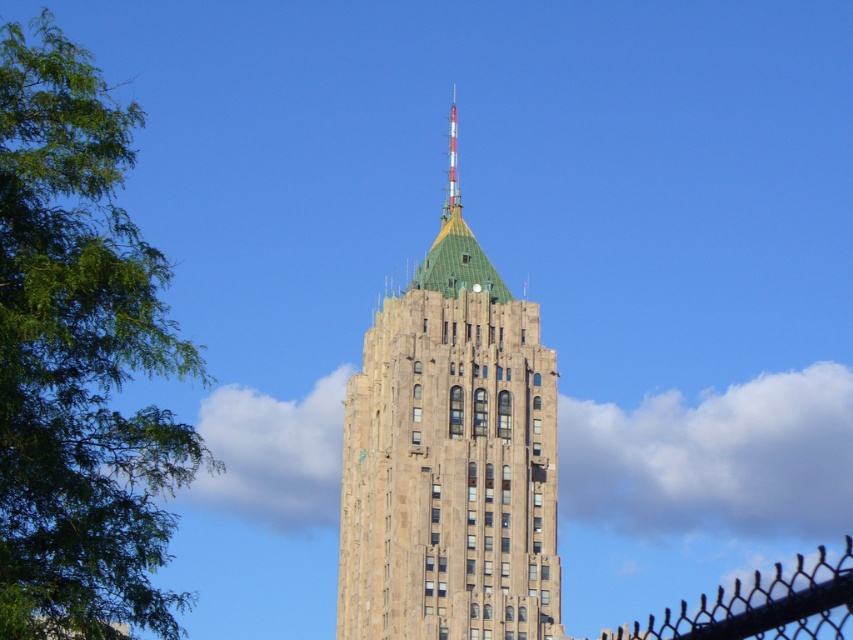
Who is higher up, black chain-link fence at lower right or white/red striped antenna at top?

white/red striped antenna at top is higher up.

Between black chain-link fence at lower right and white/red striped antenna at top, which one appears on the right side from the viewer's perspective?

Answer: From the viewer's perspective, black chain-link fence at lower right appears more on the right side.

Which is behind, point (746, 620) or point (450, 198)?

The point (450, 198) is more distant.

Locate an element on the screen. The height and width of the screenshot is (640, 853). black chain-link fence at lower right is located at coordinates (764, 608).

From the picture: Is green leafy tree at left below black chain-link fence at lower right?

Actually, green leafy tree at left is above black chain-link fence at lower right.

Is green leafy tree at left positioned before black chain-link fence at lower right?

Yes, it is in front of black chain-link fence at lower right.

Who is more distant from viewer, (170, 634) or (790, 624)?

The point (170, 634) is more distant.

Identify the location of green leafy tree at left. (79, 358).

Is green leafy tree at left shorter than brown stone building at center?

Incorrect, green leafy tree at left's height does not fall short of brown stone building at center's.

Between point (33, 316) and point (503, 284), which one is positioned in front?

Positioned in front is point (33, 316).

Locate an element on the screen. green leafy tree at left is located at coordinates (79, 358).